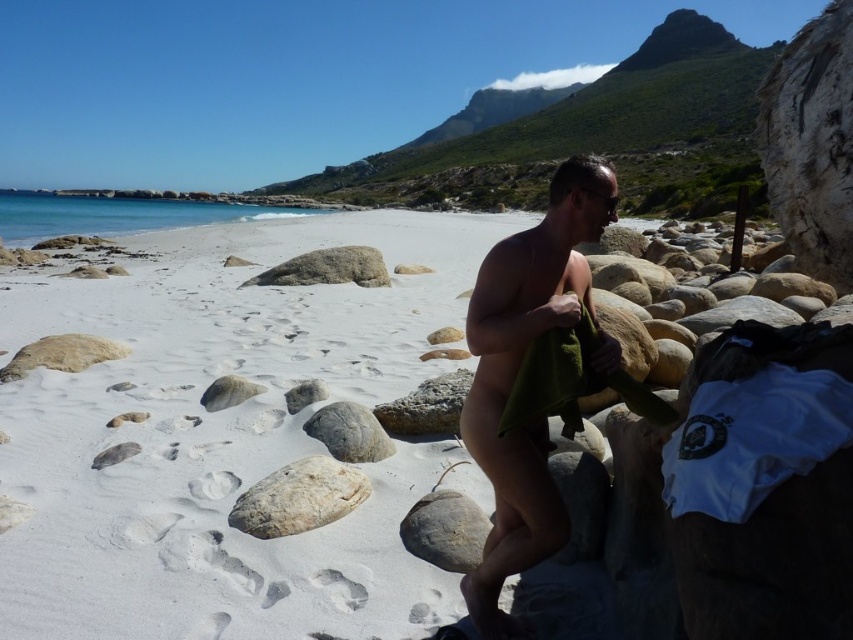
Question: Is smooth gray rock at center in front of gray smooth rock at center?

Choices:
 (A) yes
 (B) no

Answer: (B)

Question: Among these objects, which one is farthest from the camera?

Choices:
 (A) gray rough rock at lower center
 (B) white sand at center
 (C) gray smooth rock at lower left
 (D) gray smooth rock at center

Answer: (D)

Question: Is gray rough rock at center smaller than smooth beige rock at lower left?

Choices:
 (A) yes
 (B) no

Answer: (A)

Question: Which point appears closest to the camera in this image?

Choices:
 (A) (412, 522)
 (B) (244, 387)
 (C) (33, 348)
 (D) (312, 496)

Answer: (A)

Question: Which object is the farthest from the gray smooth rock at center?

Choices:
 (A) gray rough rock at center
 (B) white sand at center

Answer: (B)

Question: Does gray smooth rock at lower left have a larger size compared to smooth gray rock at center?

Choices:
 (A) yes
 (B) no

Answer: (B)